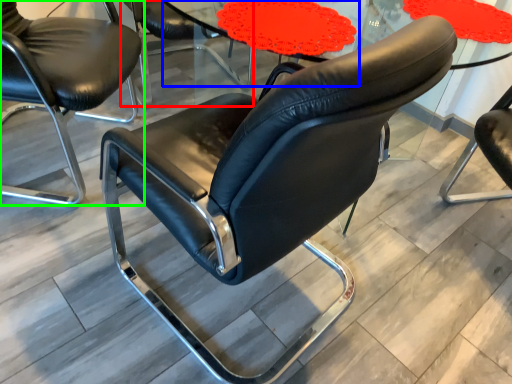
Question: Estimate the real-world distances between objects in this image. Which object is farther from chair (highlighted by a red box), round table (highlighted by a blue box) or chair (highlighted by a green box)?

Choices:
 (A) round table
 (B) chair

Answer: (B)